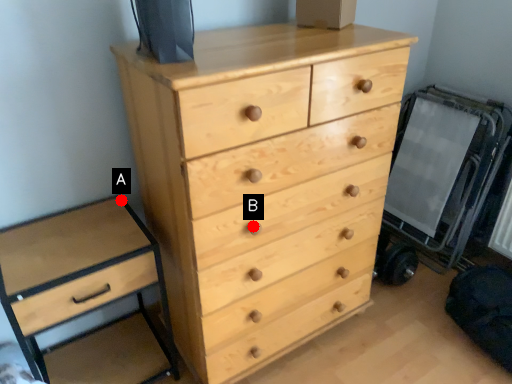
Question: Two points are circled on the image, labeled by A and B beside each circle. Which of the following is the farthest from the observer?

Choices:
 (A) A is further
 (B) B is further

Answer: (A)